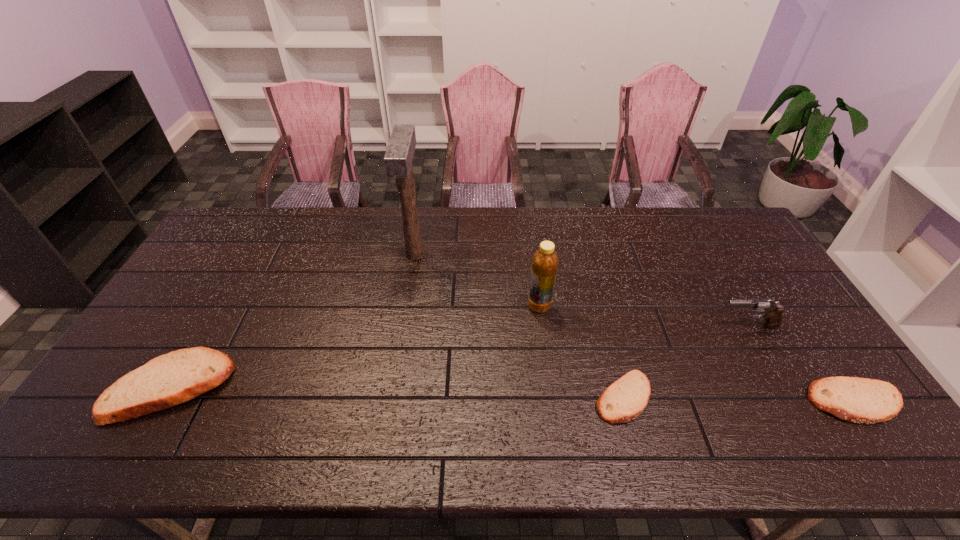
To make them evenly spaced by inserting another pita_(bread) among them, please locate a free space for this new pita_(bread). Please provide its 2D coordinates. Your answer should be formatted as a tuple, i.e. [(x, y)], where the tuple contains the x and y coordinates of a point satisfying the conditions above.

[(395, 392)]